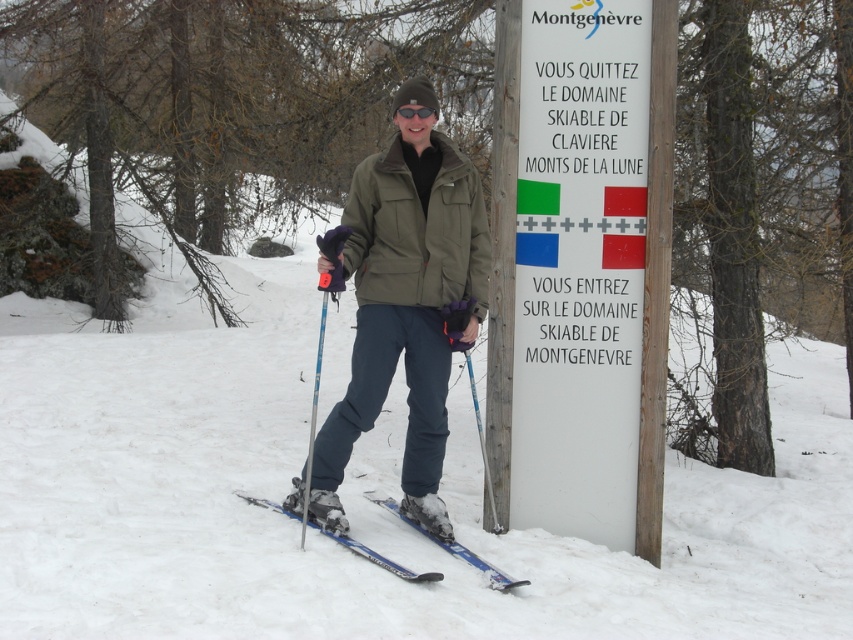
Question: Among these points, which one is farthest from the camera?

Choices:
 (A) (332, 259)
 (B) (624, 208)

Answer: (B)

Question: Does white plastic sign at upper right have a greater width compared to blue metallic skis at lower center?

Choices:
 (A) no
 (B) yes

Answer: (A)

Question: Estimate the real-world distances between objects in this image. Which object is closer to the blue metallic ski pole at lower center?

Choices:
 (A) black matte goggles at center
 (B) blue metallic skis at lower center

Answer: (A)

Question: Among these objects, which one is farthest from the camera?

Choices:
 (A) white plastic sign at upper right
 (B) olive-green fabric jacket at center
 (C) black matte goggles at center
 (D) blue metallic ski pole at lower center

Answer: (A)

Question: Does white plastic sign at upper right appear over black matte goggles at center?

Choices:
 (A) no
 (B) yes

Answer: (A)

Question: Is olive-green fabric jacket at center above blue metallic ski pole at lower center?

Choices:
 (A) yes
 (B) no

Answer: (A)